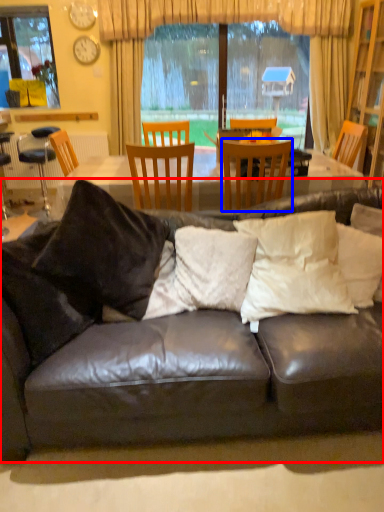
Question: Among these objects, which one is farthest to the camera, studio couch (highlighted by a red box) or chair (highlighted by a blue box)?

Choices:
 (A) studio couch
 (B) chair

Answer: (B)